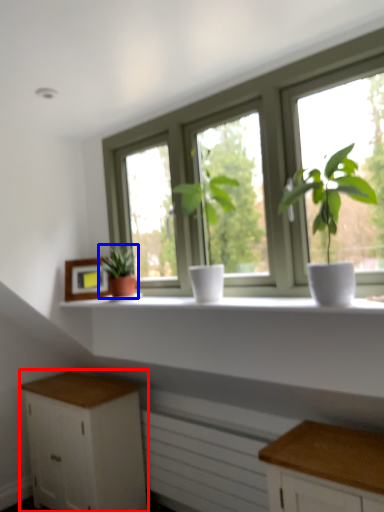
Question: Which object is further to the camera taking this photo, cabinetry (highlighted by a red box) or houseplant (highlighted by a blue box)?

Choices:
 (A) cabinetry
 (B) houseplant

Answer: (A)